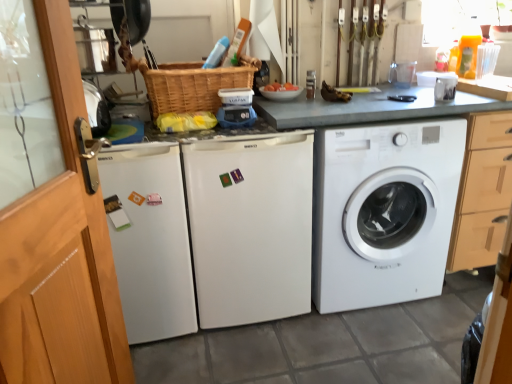
Question: Is transparent glass screen door at left, the second screen door viewed from the left, at the left side of white matte refrigerator at center, marked as the 2th washing machine in a left-to-right arrangement?

Choices:
 (A) yes
 (B) no

Answer: (A)

Question: Is transparent glass screen door at left, which is the 1th screen door in right-to-left order, next to white matte refrigerator at center, which is the 2th washing machine from right to left?

Choices:
 (A) yes
 (B) no

Answer: (B)

Question: Considering the relative sizes of transparent glass screen door at left, the second screen door viewed from the left, and white matte refrigerator at center, marked as the 2th washing machine in a left-to-right arrangement, in the image provided, is transparent glass screen door at left, the second screen door viewed from the left, smaller than white matte refrigerator at center, marked as the 2th washing machine in a left-to-right arrangement,?

Choices:
 (A) no
 (B) yes

Answer: (B)

Question: Is transparent glass screen door at left, the second screen door viewed from the left, outside of white matte refrigerator at center, which is the 2th washing machine from right to left?

Choices:
 (A) no
 (B) yes

Answer: (B)

Question: Is transparent glass screen door at left, which is the 1th screen door in right-to-left order, shorter than white matte refrigerator at center, marked as the 2th washing machine in a left-to-right arrangement?

Choices:
 (A) yes
 (B) no

Answer: (B)

Question: Is transparent glass screen door at left, which is the 1th screen door in right-to-left order, bigger than white matte refrigerator at center, marked as the 2th washing machine in a left-to-right arrangement?

Choices:
 (A) no
 (B) yes

Answer: (A)

Question: Can you confirm if wooden screen door at left, acting as the first screen door starting from the left, is taller than white matte washing machine at center, arranged as the third washing machine when viewed from the right?

Choices:
 (A) no
 (B) yes

Answer: (A)

Question: From a real-world perspective, does wooden screen door at left, acting as the first screen door starting from the left, stand above white matte washing machine at center, arranged as the third washing machine when viewed from the right?

Choices:
 (A) yes
 (B) no

Answer: (A)

Question: Could you tell me if wooden screen door at left, placed as the 2th screen door when sorted from right to left, is facing white matte washing machine at center, which is the 1th washing machine in left-to-right order?

Choices:
 (A) yes
 (B) no

Answer: (B)

Question: Is wooden screen door at left, placed as the 2th screen door when sorted from right to left, positioned before white matte washing machine at center, arranged as the third washing machine when viewed from the right?

Choices:
 (A) no
 (B) yes

Answer: (B)

Question: Is wooden screen door at left, acting as the first screen door starting from the left, to the right of white matte washing machine at center, which is the 1th washing machine in left-to-right order, from the viewer's perspective?

Choices:
 (A) yes
 (B) no

Answer: (A)

Question: From a real-world perspective, is wooden screen door at left, placed as the 2th screen door when sorted from right to left, below white matte washing machine at center, which is the 1th washing machine in left-to-right order?

Choices:
 (A) no
 (B) yes

Answer: (A)

Question: Is white matte refrigerator at center, marked as the 2th washing machine in a left-to-right arrangement, to the right of white matte washing machine at center, which is the 1th washing machine in left-to-right order, from the viewer's perspective?

Choices:
 (A) yes
 (B) no

Answer: (A)